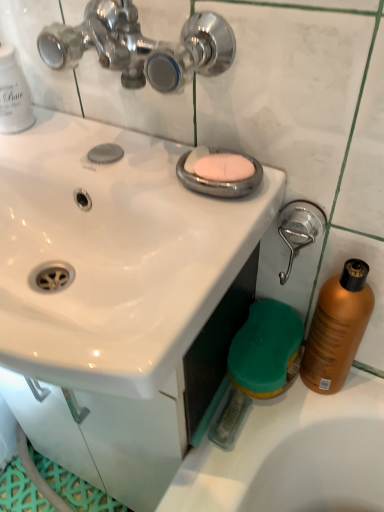
Question: From a real-world perspective, is shiny orange bottle at right positioned under pink matte soap at center based on gravity?

Choices:
 (A) yes
 (B) no

Answer: (A)

Question: Is the depth of shiny orange bottle at right less than that of pink matte soap at center?

Choices:
 (A) no
 (B) yes

Answer: (A)

Question: Is shiny orange bottle at right not close to pink matte soap at center?

Choices:
 (A) yes
 (B) no

Answer: (B)

Question: Does shiny orange bottle at right appear on the left side of pink matte soap at center?

Choices:
 (A) no
 (B) yes

Answer: (A)

Question: Is shiny orange bottle at right to the right of pink matte soap at center from the viewer's perspective?

Choices:
 (A) yes
 (B) no

Answer: (A)

Question: Considering the relative positions of pink matte soap at center and shiny orange bottle at right in the image provided, is pink matte soap at center to the left or to the right of shiny orange bottle at right?

Choices:
 (A) left
 (B) right

Answer: (A)

Question: Is pink matte soap at center taller or shorter than shiny orange bottle at right?

Choices:
 (A) tall
 (B) short

Answer: (B)

Question: In terms of width, does pink matte soap at center look wider or thinner when compared to shiny orange bottle at right?

Choices:
 (A) thin
 (B) wide

Answer: (A)

Question: From a real-world perspective, is pink matte soap at center physically located above or below shiny orange bottle at right?

Choices:
 (A) above
 (B) below

Answer: (A)

Question: Do you think pink matte soap at center is within white glossy sink at upper center, or outside of it?

Choices:
 (A) inside
 (B) outside

Answer: (B)

Question: From the image's perspective, is pink matte soap at center above or below white glossy sink at upper center?

Choices:
 (A) below
 (B) above

Answer: (B)

Question: Relative to white glossy sink at upper center, is pink matte soap at center in front or behind?

Choices:
 (A) front
 (B) behind

Answer: (B)

Question: From a real-world perspective, is pink matte soap at center above or below white glossy sink at upper center?

Choices:
 (A) below
 (B) above

Answer: (B)

Question: Looking at the image, does shiny orange bottle at right seem bigger or smaller compared to pink matte soap at center?

Choices:
 (A) small
 (B) big

Answer: (B)

Question: Relative to pink matte soap at center, is shiny orange bottle at right in front or behind?

Choices:
 (A) behind
 (B) front

Answer: (A)